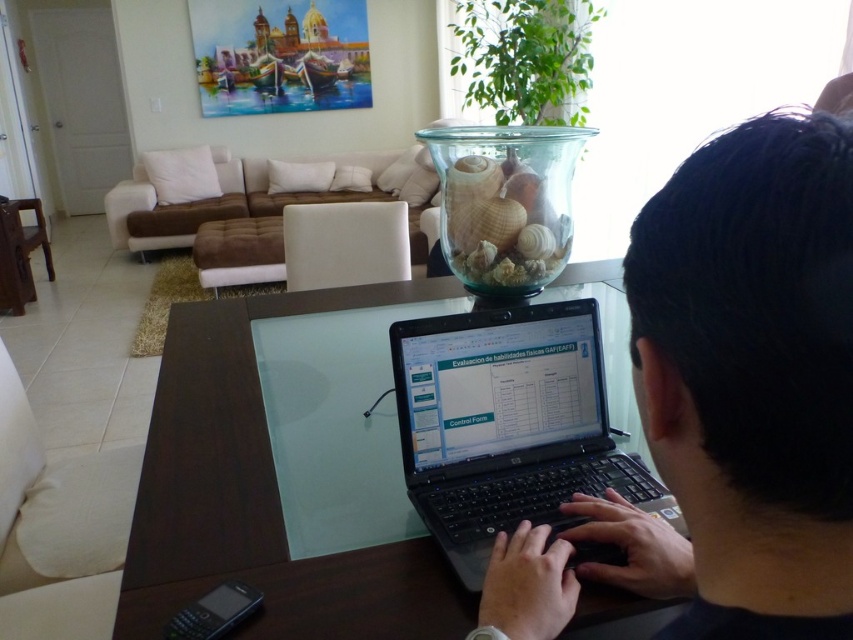
What do you see at coordinates (727, 401) in the screenshot? I see `black matte laptop at center` at bounding box center [727, 401].

Is black matte laptop at center taller than black plastic laptop at center?

Indeed, black matte laptop at center has a greater height compared to black plastic laptop at center.

Which is in front, point (733, 634) or point (679, 518)?

Point (733, 634)

Where is `black matte laptop at center`? black matte laptop at center is located at coordinates (727, 401).

Who is lower down, black matte laptop at center or transparent glass table at center?

black matte laptop at center

Who is more forward, (x=643, y=372) or (x=408, y=285)?

Point (x=643, y=372) is more forward.

Identify the location of black matte laptop at center. This screenshot has width=853, height=640. (727, 401).

Is point (233, 442) positioned after point (514, 364)?

Yes, point (233, 442) is farther from viewer.

Between point (589, 605) and point (589, 326), which one is positioned in front?

Point (589, 605)

Describe the element at coordinates (265, 483) in the screenshot. I see `transparent glass table at center` at that location.

Where is `transparent glass table at center`? transparent glass table at center is located at coordinates (265, 483).